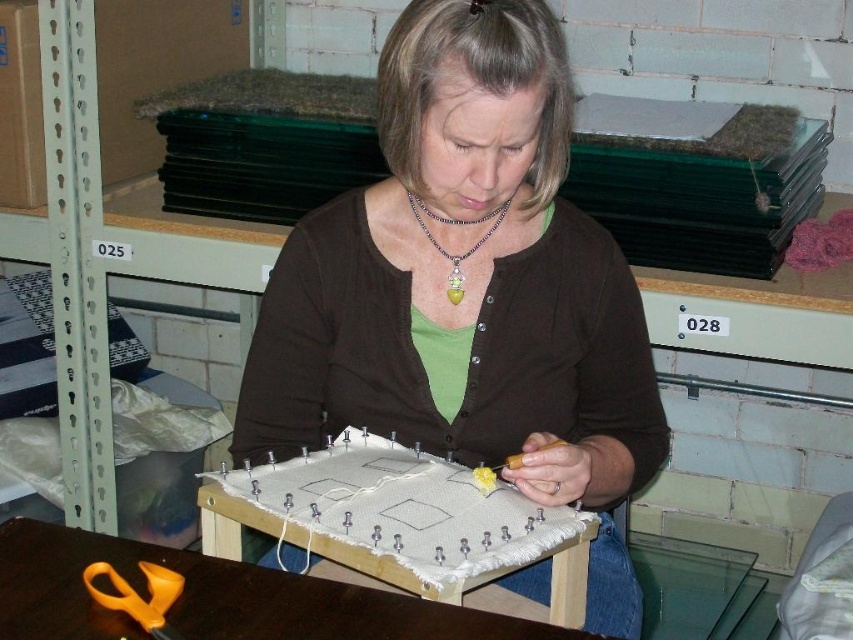
You are a visitor observing the crafting setup. The brown matte sweater at center and the wooden table at lower center are in your view. Which object is positioned higher relative to the other?

The brown matte sweater at center is above the wooden table at lower center, so it is positioned higher.

You are a tailor trying to reach the yellow plastic scissors at lower left but the brown matte sweater at center is in the way. Can you slide the sweater to the side to access the scissors?

The brown matte sweater at center is wider than the yellow plastic scissors at lower left, so sliding the sweater might require more space. However, since the sweater is at the center, moving it slightly to either side could free up access to the scissors at lower left.